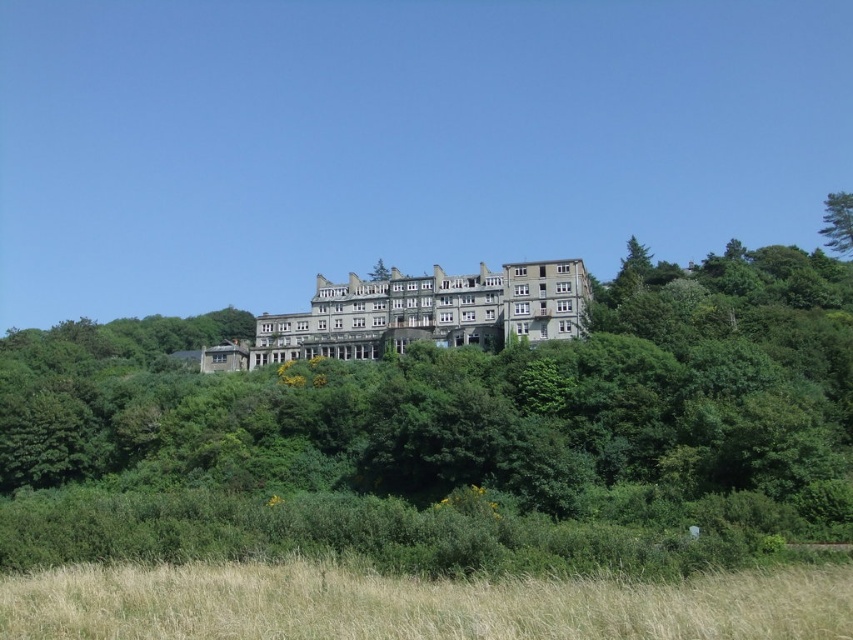
Question: Can you confirm if dry grass at lower center is positioned to the left of stone mansion at center?

Choices:
 (A) no
 (B) yes

Answer: (A)

Question: Is green leafy tree at center to the left of dry grass at lower center from the viewer's perspective?

Choices:
 (A) no
 (B) yes

Answer: (B)

Question: Which object is the closest to the dry grass at lower center?

Choices:
 (A) green leafy tree at upper right
 (B) stone mansion at center

Answer: (B)

Question: Which of the following is the closest to the observer?

Choices:
 (A) (321, 301)
 (B) (837, 243)
 (C) (506, 432)
 (D) (543, 604)

Answer: (D)

Question: Which point appears farthest from the camera in this image?

Choices:
 (A) (440, 339)
 (B) (132, 474)
 (C) (335, 602)

Answer: (A)

Question: Does green leafy tree at center have a smaller size compared to dry grass at lower center?

Choices:
 (A) yes
 (B) no

Answer: (B)